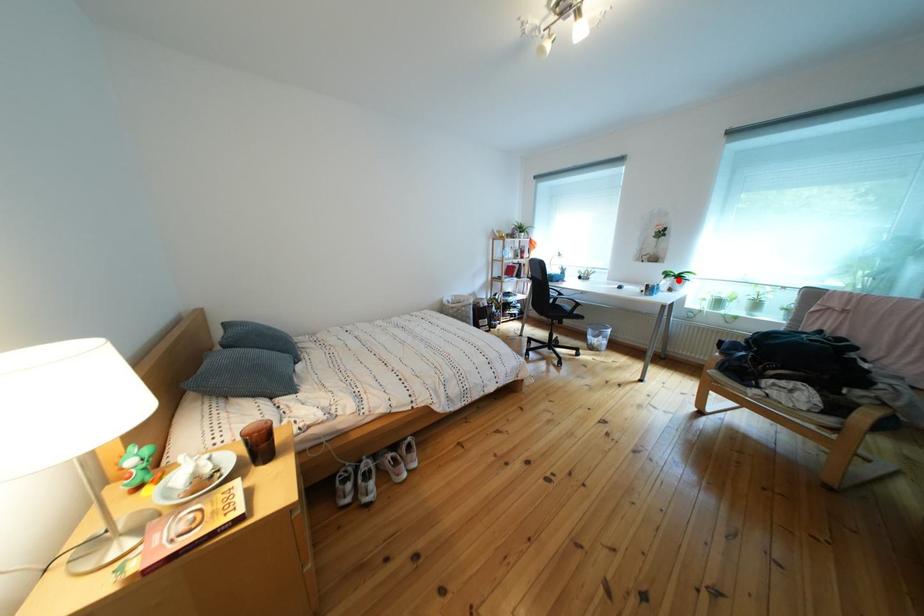
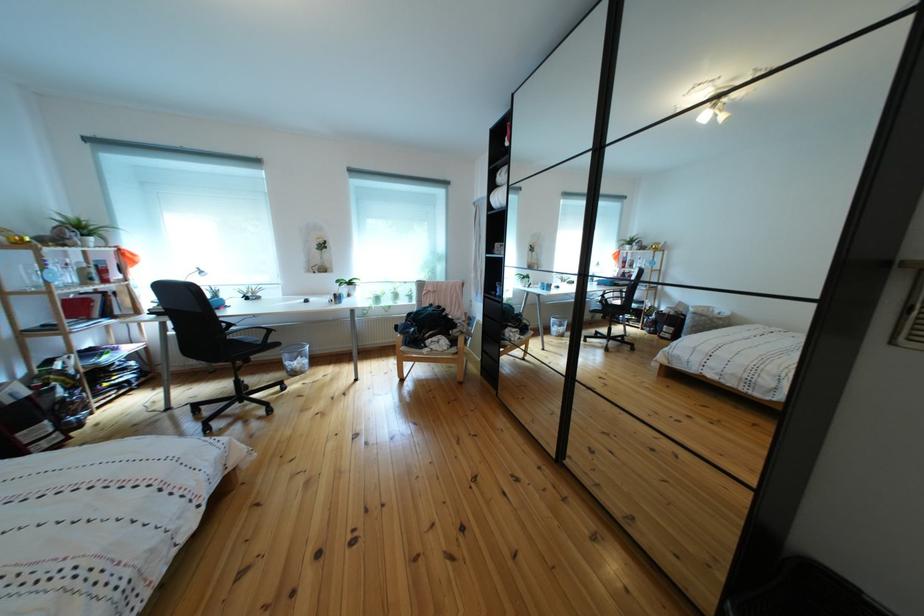
Question: A red point is marked in image1. In image2, is the corresponding 3D point closer to the camera or farther? Reply with the corresponding letter.

Choices:
 (A) The corresponding 3D point is closer.
 (B) The corresponding 3D point is farther.

Answer: (A)